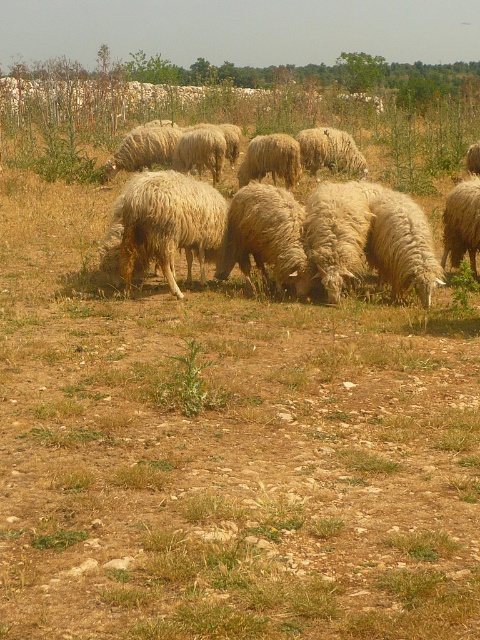
Is point (477, 214) behind point (241, 170)?

That is False.

Identify the location of white woolly sheep at right. (462, 224).

Where is `white woolly sheep at right`? The width and height of the screenshot is (480, 640). white woolly sheep at right is located at coordinates tap(462, 224).

Does point (402, 250) come closer to viewer compared to point (456, 196)?

Yes, point (402, 250) is closer to viewer.

The image size is (480, 640). What do you see at coordinates (381, 234) in the screenshot? I see `fuzzy woolly sheep at center` at bounding box center [381, 234].

This screenshot has height=640, width=480. In order to click on fuzzy woolly sheep at center in this screenshot , I will do `click(381, 234)`.

Does point (266, 234) lie in front of point (467, 204)?

That is True.

What do you see at coordinates (265, 236) in the screenshot?
I see `white woolly sheep at center` at bounding box center [265, 236].

The width and height of the screenshot is (480, 640). I want to click on white woolly sheep at center, so click(x=265, y=236).